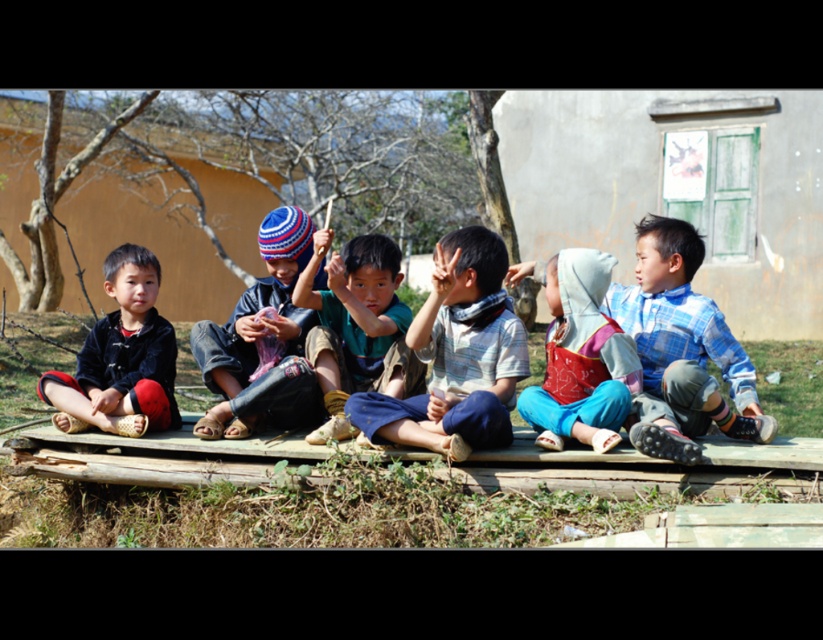
Looking at the scene of the six children on the wooden platform, can you tell me which object is positioned to the right of the other between the blue plaid shirt at right and the knitted woolen hat at center?

The blue plaid shirt at right is positioned to the right of the knitted woolen hat at center.

You are a photographer trying to capture a group photo of the blue plaid shirt at right and the knitted woolen hat at center. The camera you have can only focus on objects within a 2 meter range. Will both subjects be in focus?

The blue plaid shirt at right is 2.47 meters from knitted woolen hat at center. Since the camera requires both subjects to be within 2 meters to focus properly, they are slightly out of range. The photographer might need to adjust their position to bring them closer together or use a different camera setting.

Based on the photo, you are a photographer trying to capture a photo of the two points mentioned in the scene. Which point, point (x=468, y=436) or point (x=161, y=362), will appear larger in your photo?

Point (x=468, y=436) is closer to the camera than point (x=161, y=362), so it will appear larger in the photo.